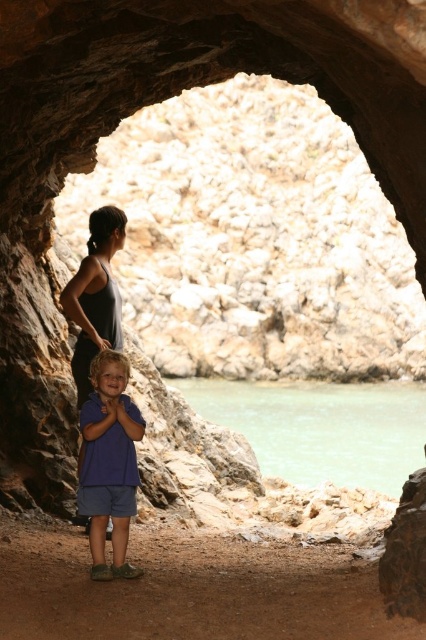
You are a photographer standing inside the cave. You want to take a photo of both the green water at lower center and the rusty rock at lower right. Which object should you focus on first to ensure both are in clear view?

You should focus on the green water at lower center first because the rusty rock at lower right is behind it, so focusing on the closer object will keep both in focus.